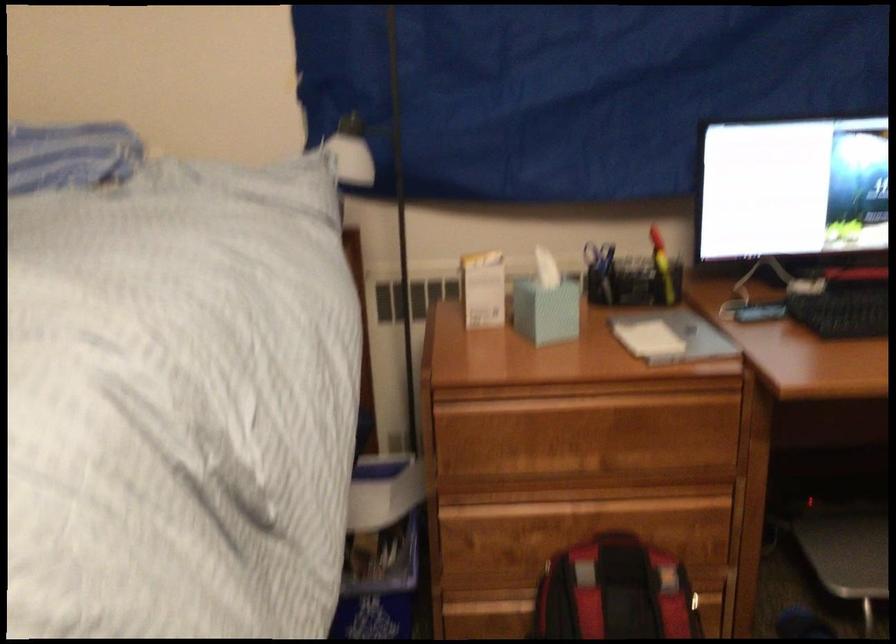
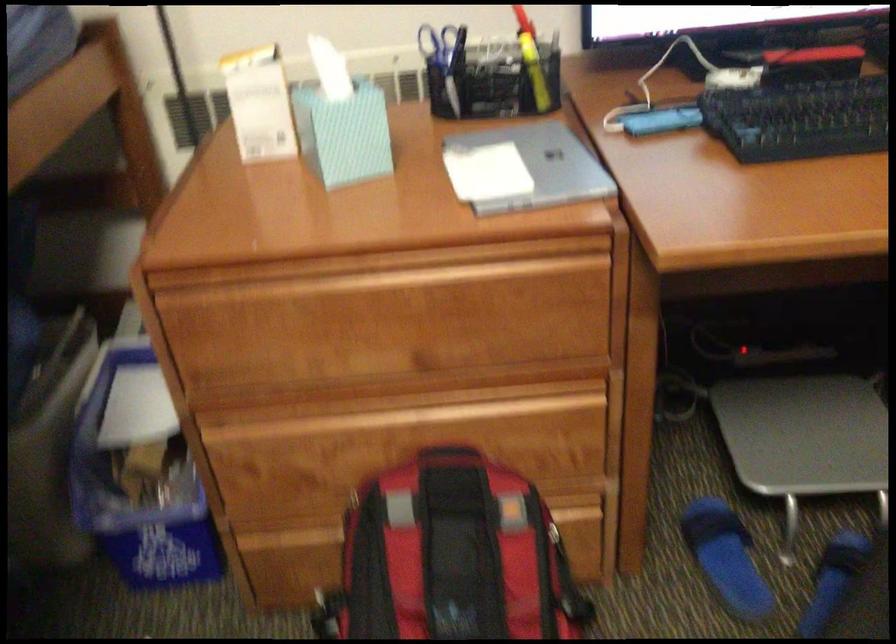
The images are taken continuously from a first-person perspective. In which direction are you moving?

The cameraman walked toward right, forward.